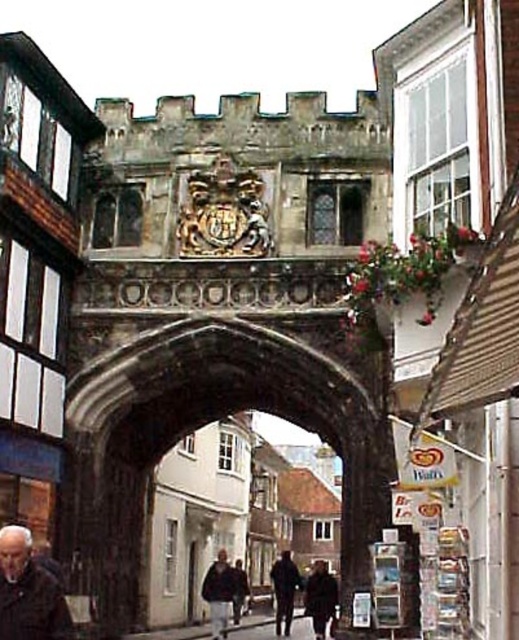
You are a painter standing in the narrow street and want to paint both the stone archway at center and the dark brown coat at center. Which object should you focus on first if you want to capture the tallest object in your painting?

The stone archway at center has a greater height compared to the dark brown coat at center, so you should focus on painting the stone archway at center first as it is taller.